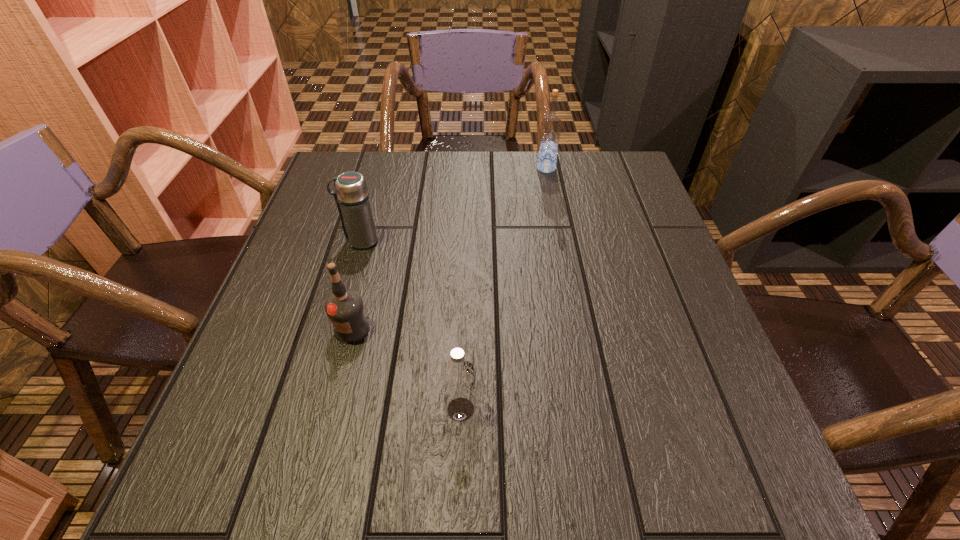
You are a GUI agent. You are given a task and a screenshot of the screen. Output one action in this format:
    pyautogui.click(x=<x>, y=<y>)
    Task: Click on the rightmost object
    This screenshot has width=960, height=540.
    Given the screenshot: What is the action you would take?
    pyautogui.click(x=550, y=130)

The width and height of the screenshot is (960, 540). Find the location of `the farthest object`. the farthest object is located at coordinates (550, 130).

Find the location of `the third nearest object`. the third nearest object is located at coordinates (351, 194).

The width and height of the screenshot is (960, 540). What are the coordinates of `the third farthest object` in the screenshot? It's located at coord(345,308).

The width and height of the screenshot is (960, 540). Identify the location of the leftmost vodka. point(345,308).

Find the location of a particular element. Image resolution: width=960 pixels, height=540 pixels. the second object from right to left is located at coordinates (458, 375).

You are a GUI agent. You are given a task and a screenshot of the screen. Output one action in this format:
    pyautogui.click(x=<x>, y=<y>)
    Task: Click on the nearest vodka
    
    Given the screenshot: What is the action you would take?
    pyautogui.click(x=458, y=375)

Find the location of a particular element. The height and width of the screenshot is (540, 960). vacant space located on the front of the farthest object is located at coordinates (549, 186).

You are a GUI agent. You are given a task and a screenshot of the screen. Output one action in this format:
    pyautogui.click(x=<x>, y=<y>)
    Task: Click on the vacant space located with a handle on the side of the third nearest object
    This screenshot has width=960, height=540.
    Given the screenshot: What is the action you would take?
    pyautogui.click(x=300, y=241)

The image size is (960, 540). In order to click on free space located on the front label of the second nearest object in this screenshot , I will do `click(343, 367)`.